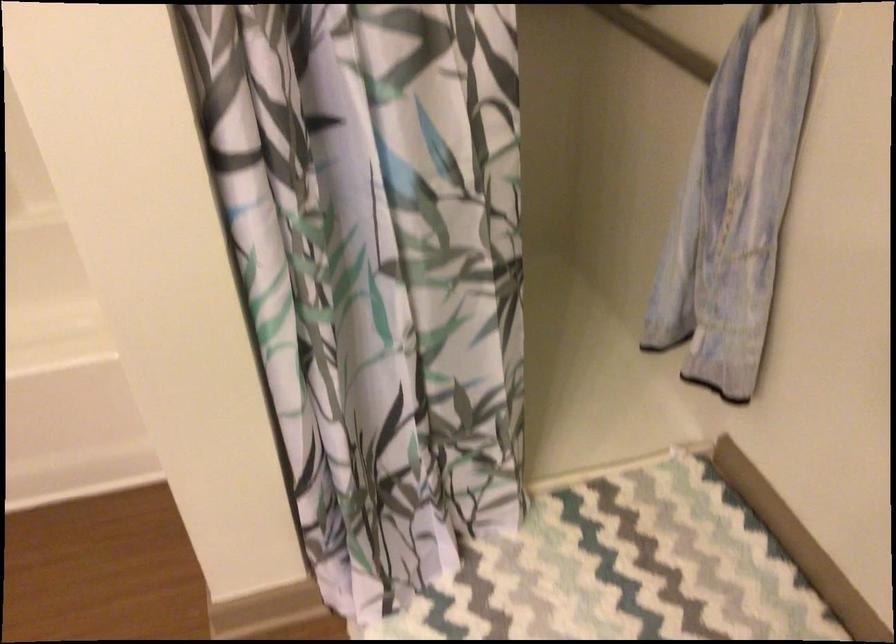
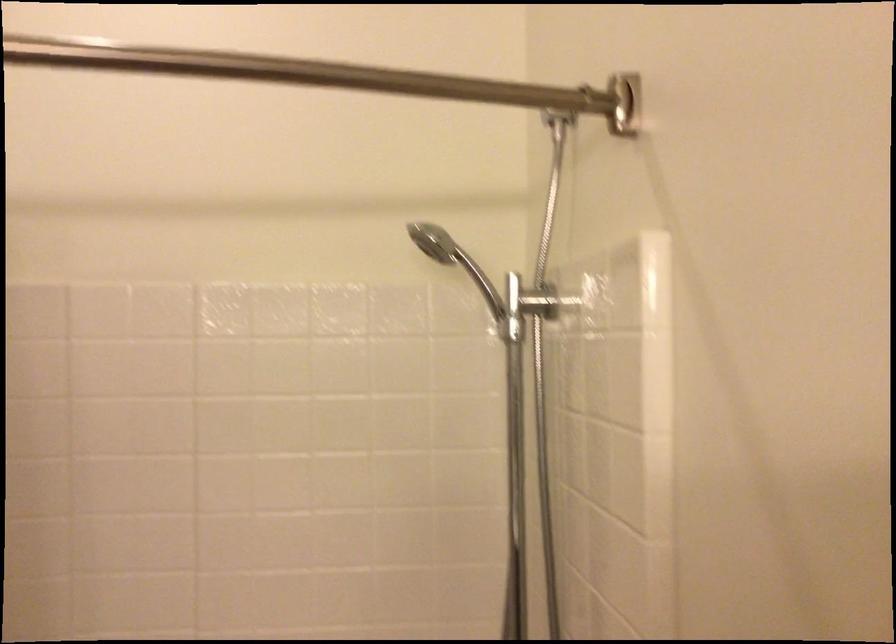
The images are taken continuously from a first-person perspective. In which direction is your viewpoint rotating?

The camera rotated toward left-up.